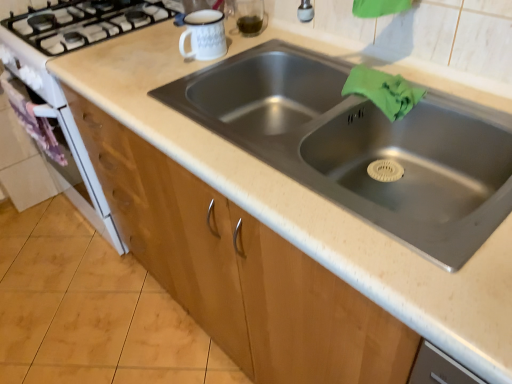
Find the location of a particular element. free space above wooden cabinet at lower center (from a real-world perspective) is located at coordinates (94, 297).